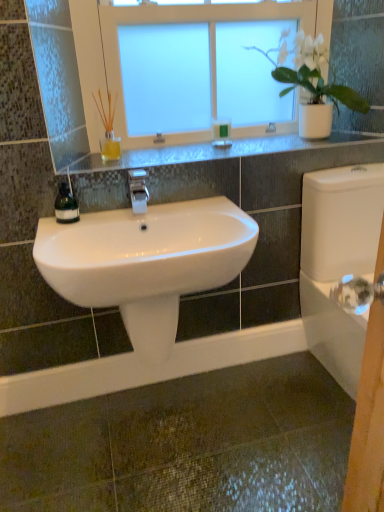
Question: From a real-world perspective, is green matte soap at upper center positioned under green matte soap dispenser at left based on gravity?

Choices:
 (A) no
 (B) yes

Answer: (A)

Question: Is green matte soap at upper center wider than green matte soap dispenser at left?

Choices:
 (A) no
 (B) yes

Answer: (B)

Question: Would you say green matte soap at upper center is a long distance from green matte soap dispenser at left?

Choices:
 (A) yes
 (B) no

Answer: (B)

Question: From a real-world perspective, does green matte soap at upper center stand above green matte soap dispenser at left?

Choices:
 (A) yes
 (B) no

Answer: (A)

Question: Is green matte soap at upper center thinner than green matte soap dispenser at left?

Choices:
 (A) yes
 (B) no

Answer: (B)

Question: Does green matte soap at upper center have a lesser height compared to green matte soap dispenser at left?

Choices:
 (A) no
 (B) yes

Answer: (B)

Question: From a real-world perspective, is white matte pot at upper right on top of white glossy faucet at center?

Choices:
 (A) yes
 (B) no

Answer: (A)

Question: Is white matte pot at upper right turned away from white glossy faucet at center?

Choices:
 (A) no
 (B) yes

Answer: (A)

Question: Considering the relative sizes of white matte pot at upper right and white glossy faucet at center in the image provided, is white matte pot at upper right wider than white glossy faucet at center?

Choices:
 (A) no
 (B) yes

Answer: (B)

Question: Can you see white matte pot at upper right touching white glossy faucet at center?

Choices:
 (A) no
 (B) yes

Answer: (A)

Question: Is white matte pot at upper right at the left side of white glossy faucet at center?

Choices:
 (A) yes
 (B) no

Answer: (B)

Question: Can you confirm if white matte pot at upper right is shorter than white glossy faucet at center?

Choices:
 (A) no
 (B) yes

Answer: (A)

Question: Is green matte soap dispenser at left to the right of white frosted glass window at upper center from the viewer's perspective?

Choices:
 (A) yes
 (B) no

Answer: (B)